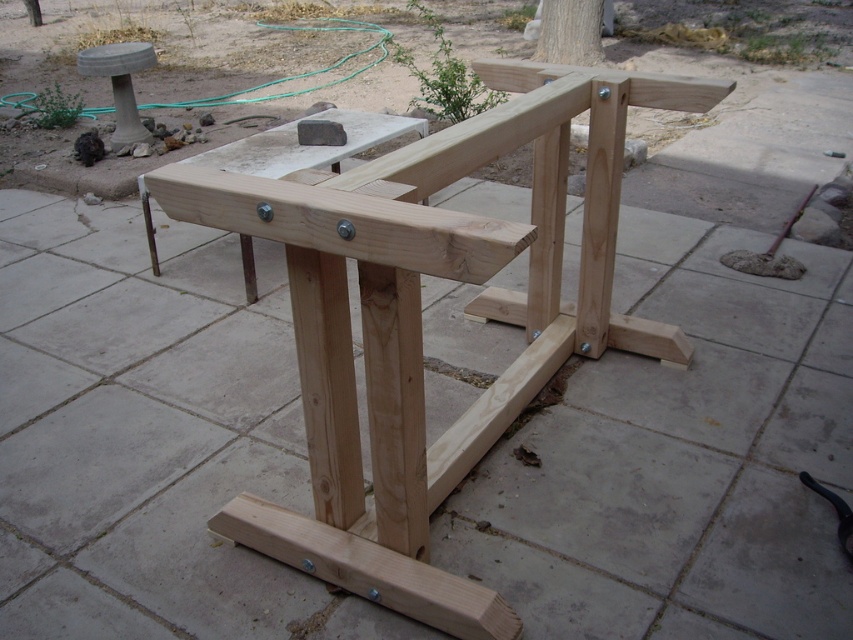
Looking at this image, can you confirm if natural wood frame at center is positioned to the left of smooth concrete stool at upper left?

In fact, natural wood frame at center is to the right of smooth concrete stool at upper left.

How far apart are natural wood frame at center and smooth concrete stool at upper left?

natural wood frame at center and smooth concrete stool at upper left are 3.20 meters apart from each other.

Locate an element on the screen. This screenshot has height=640, width=853. natural wood frame at center is located at coordinates (421, 317).